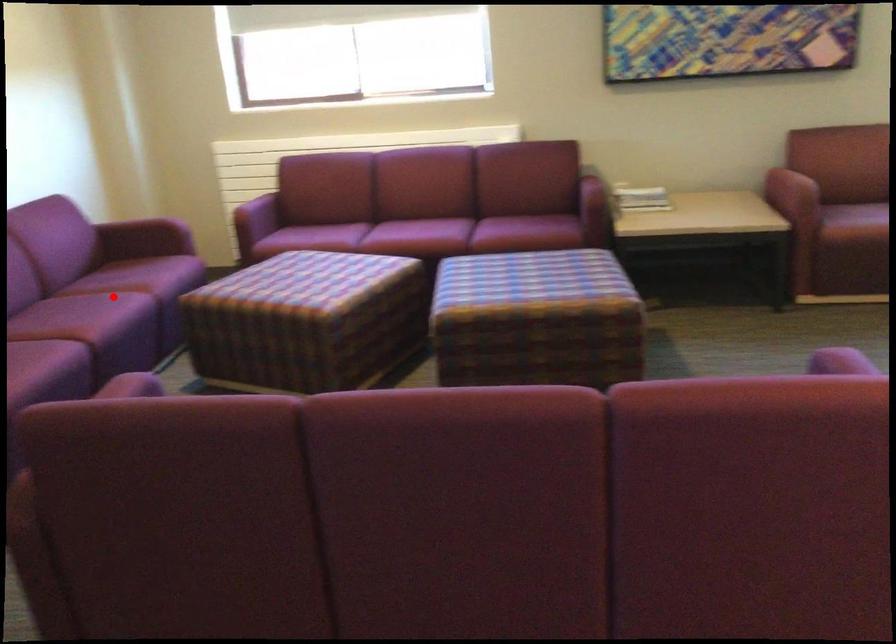
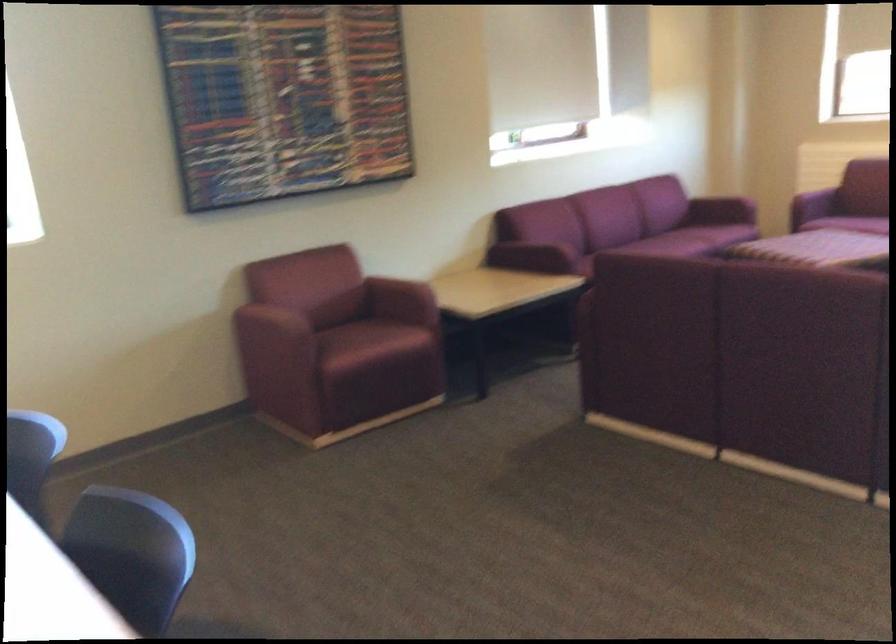
Locate, in the second image, the point that corresponds to the highlighted location in the first image.

(683, 242)